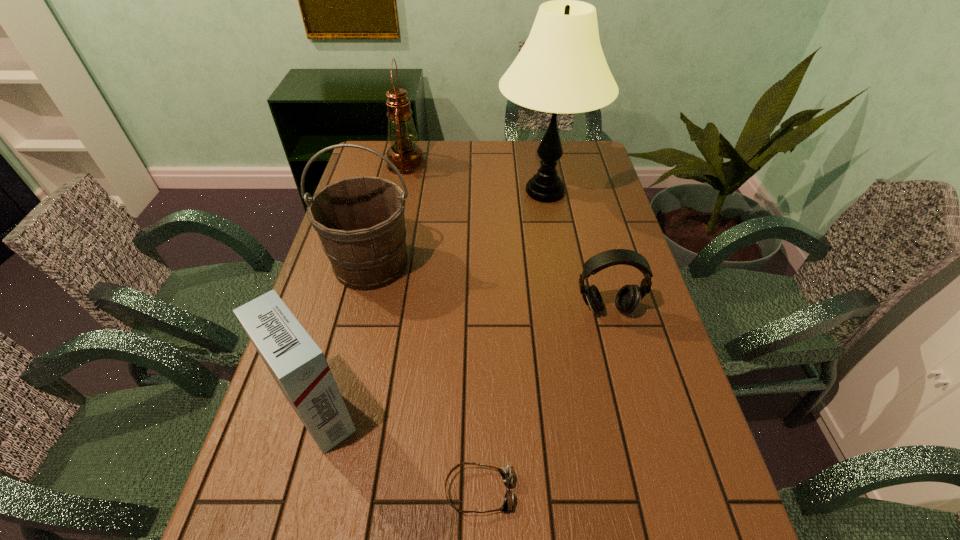
I want to click on the tallest object, so pyautogui.click(x=561, y=68).

Find the location of a particular element. The width and height of the screenshot is (960, 540). oil lamp is located at coordinates (404, 153).

Locate an element on the screen. This screenshot has width=960, height=540. the third farthest object is located at coordinates (360, 221).

This screenshot has width=960, height=540. Identify the location of the third shortest object. (299, 367).

At what (x,y) coordinates should I click in order to perform the action: click on the fifth farthest object. Please return your answer as a coordinate pair (x, y). Looking at the image, I should click on (299, 367).

I want to click on earphone, so click(628, 298).

Locate an element on the screen. the fourth farthest object is located at coordinates (628, 298).

Identify the location of the shortest object. (505, 472).

At what (x,y) coordinates should I click in order to perform the action: click on goggles. Please return your answer as a coordinate pair (x, y). The width and height of the screenshot is (960, 540). Looking at the image, I should click on (505, 472).

At what (x,y) coordinates should I click in order to perform the action: click on free location located on the left of the lamp. Please return your answer as a coordinate pair (x, y). Looking at the image, I should click on (387, 192).